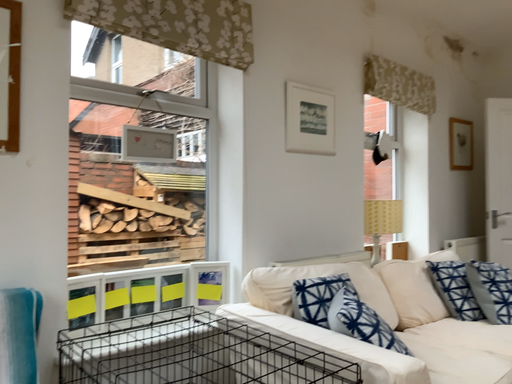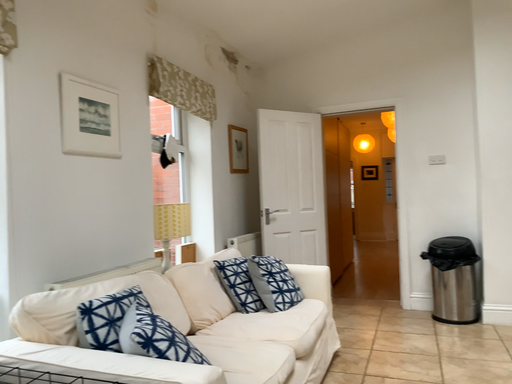
Question: Which way did the camera rotate in the video?

Choices:
 (A) rotated left
 (B) rotated right

Answer: (B)